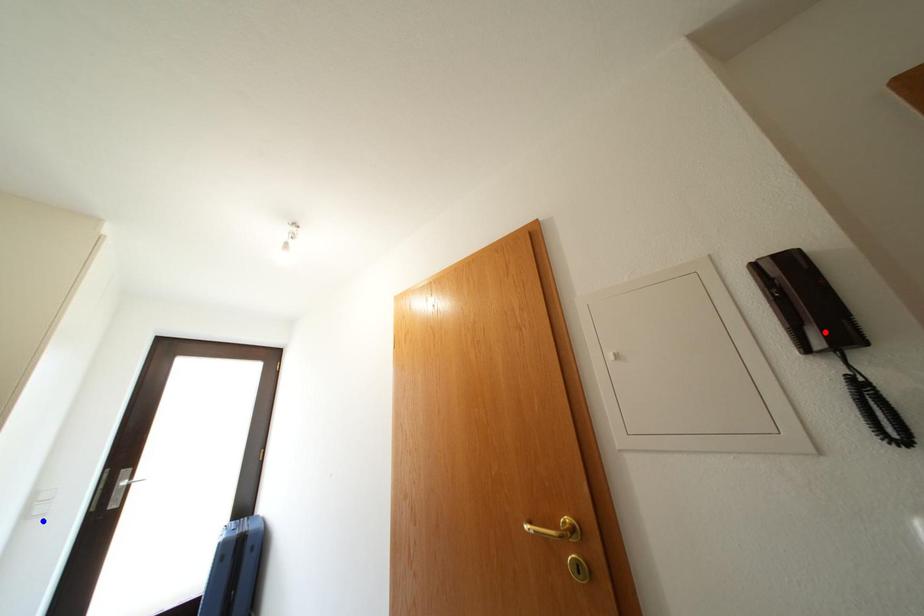
Question: Two points are marked on the image. Which point is closer to the camera?

Choices:
 (A) Blue point is closer.
 (B) Red point is closer.

Answer: (B)